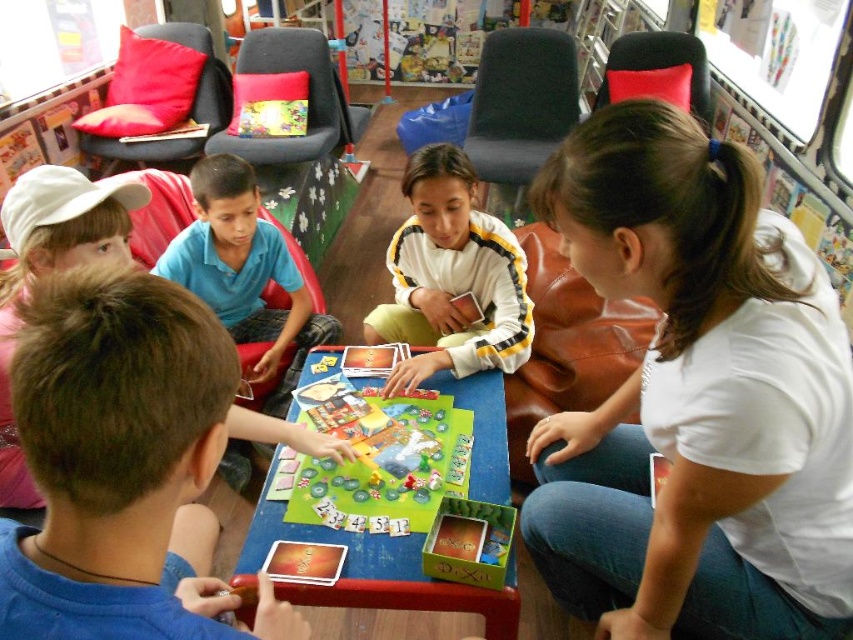
Is white fleece sweater at center above white cap at upper left?

Yes, white fleece sweater at center is above white cap at upper left.

What are the coordinates of `white fleece sweater at center` in the screenshot? It's located at (451, 276).

Does point (445, 364) lie in front of point (10, 460)?

That is False.

I want to click on white fleece sweater at center, so click(451, 276).

This screenshot has height=640, width=853. What do you see at coordinates (119, 458) in the screenshot?
I see `brown hair at lower left` at bounding box center [119, 458].

Locate an element on the screen. This screenshot has height=640, width=853. brown hair at lower left is located at coordinates [x=119, y=458].

This screenshot has width=853, height=640. What are the coordinates of `brown hair at lower left` in the screenshot? It's located at (119, 458).

Can you confirm if brown hair at lower left is thinner than white cap at upper left?

Correct, brown hair at lower left's width is less than white cap at upper left's.

Does point (42, 474) lie behind point (100, 256)?

No, it is in front of (100, 256).

Image resolution: width=853 pixels, height=640 pixels. Identify the location of brown hair at lower left. (119, 458).